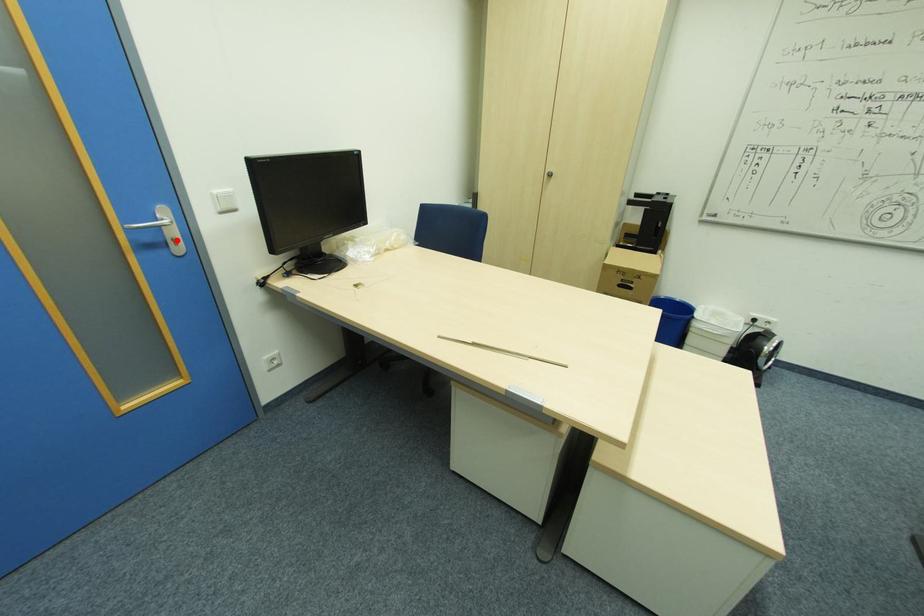
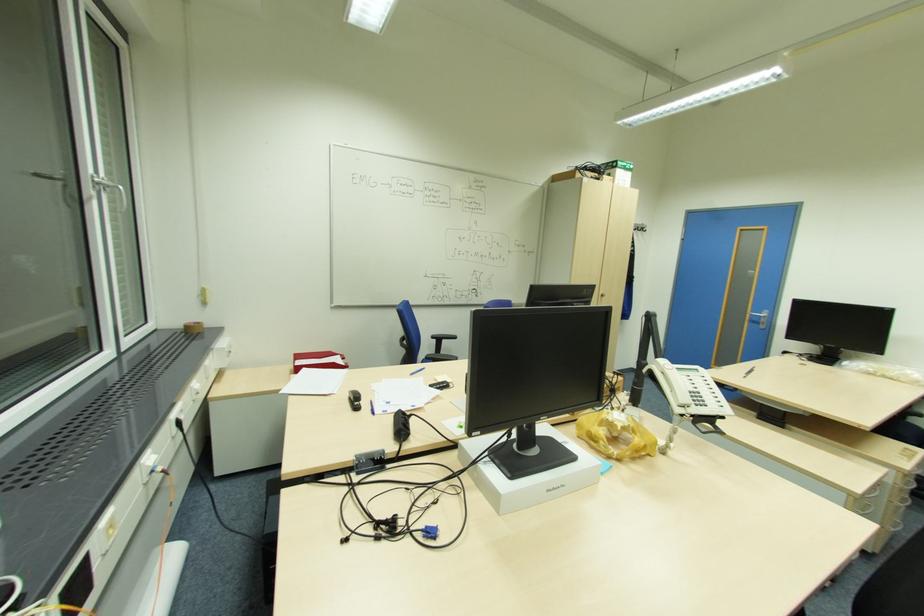
In the second image, find the point that corresponds to the highlighted location in the first image.

(766, 323)